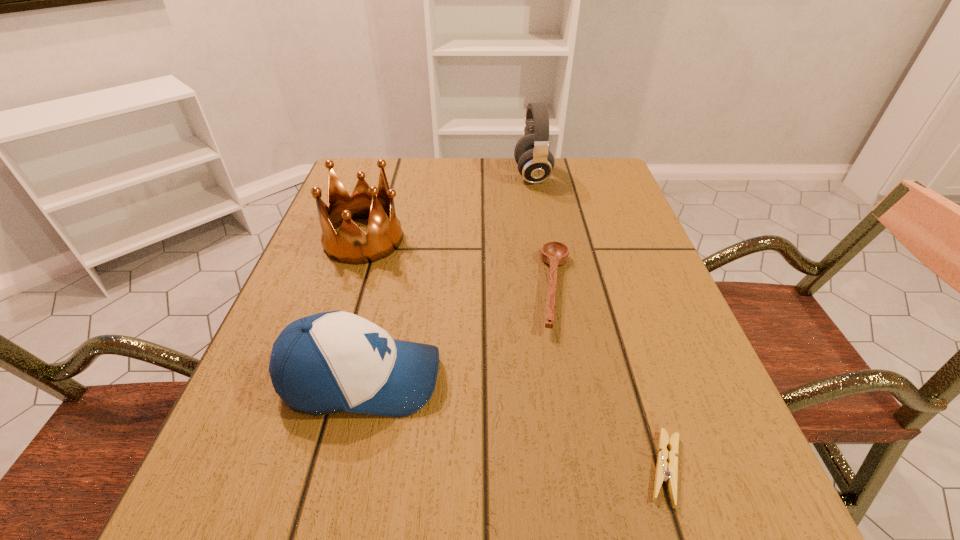
Where is `blank area located 0.330m on the front of the crown`? Image resolution: width=960 pixels, height=540 pixels. blank area located 0.330m on the front of the crown is located at coordinates (310, 406).

Where is `vacant space located 0.100m on the front-facing side of the second nearest object`? Image resolution: width=960 pixels, height=540 pixels. vacant space located 0.100m on the front-facing side of the second nearest object is located at coordinates (503, 379).

Identify the location of blank space located 0.060m on the back of the second shortest object. (545, 234).

This screenshot has height=540, width=960. In order to click on free space located 0.070m on the left of the nearest object in this screenshot , I will do `click(591, 468)`.

Image resolution: width=960 pixels, height=540 pixels. Identify the location of object located in the far edge section of the desktop. (535, 162).

Identify the location of object present at the near edge. [x=668, y=472].

Where is `crown present at the left edge`? The height and width of the screenshot is (540, 960). crown present at the left edge is located at coordinates tap(351, 245).

Where is `baseball cap that is at the left edge`? The height and width of the screenshot is (540, 960). baseball cap that is at the left edge is located at coordinates (331, 362).

Identify the location of object at the right edge. The width and height of the screenshot is (960, 540). (668, 472).

Where is `object positioned at the near right corner`? object positioned at the near right corner is located at coordinates (668, 472).